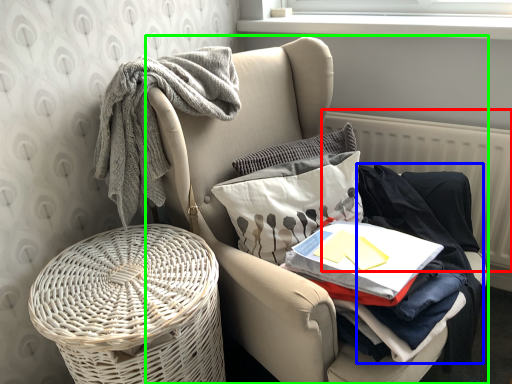
Question: Which object is positioned farthest from radiator (highlighted by a red box)? Select from clothing (highlighted by a blue box) and chair (highlighted by a green box).

Choices:
 (A) clothing
 (B) chair

Answer: (B)